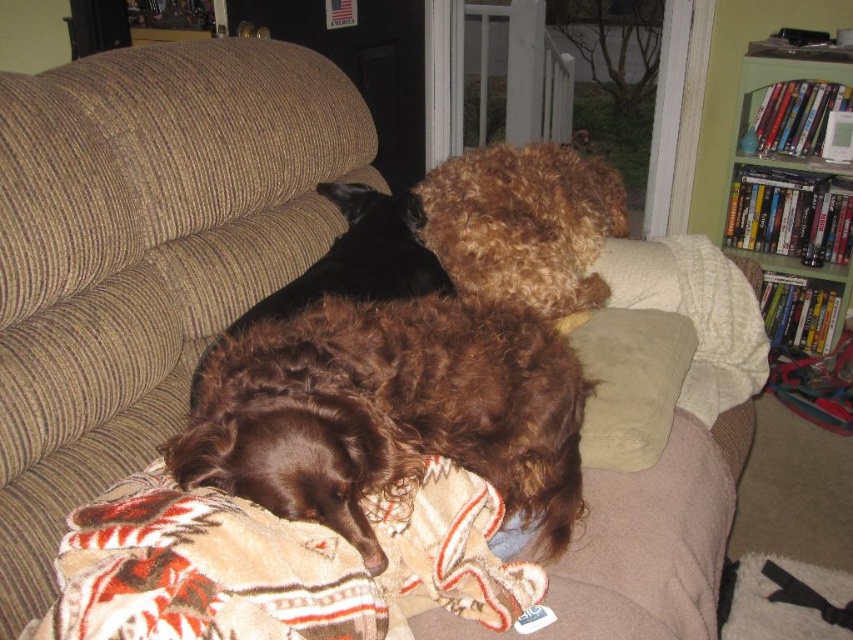
Does brown curly fur dog at center come in front of green wooden bookshelf at upper right?

Yes, brown curly fur dog at center is closer to the viewer.

Image resolution: width=853 pixels, height=640 pixels. What do you see at coordinates (387, 412) in the screenshot?
I see `brown curly fur dog at center` at bounding box center [387, 412].

Is point (325, 417) farther from viewer compared to point (764, 259)?

That is False.

The image size is (853, 640). In order to click on brown curly fur dog at center in this screenshot , I will do `click(387, 412)`.

Who is higher up, brown curly fur dog at center or suede-like beige pillow at center?

suede-like beige pillow at center is above.

Can you confirm if brown curly fur dog at center is bigger than suede-like beige pillow at center?

Answer: Correct, brown curly fur dog at center is larger in size than suede-like beige pillow at center.

Who is more forward, [368,422] or [666,432]?

Point [368,422] is more forward.

Locate an element on the screen. The height and width of the screenshot is (640, 853). brown curly fur dog at center is located at coordinates (387, 412).

Is brown curly fur dog at center to the right of plush beige blanket at lower center from the viewer's perspective?

Yes, brown curly fur dog at center is to the right of plush beige blanket at lower center.

Is brown curly fur dog at center positioned before plush beige blanket at lower center?

No.

The width and height of the screenshot is (853, 640). Find the location of `brown curly fur dog at center`. brown curly fur dog at center is located at coordinates (387, 412).